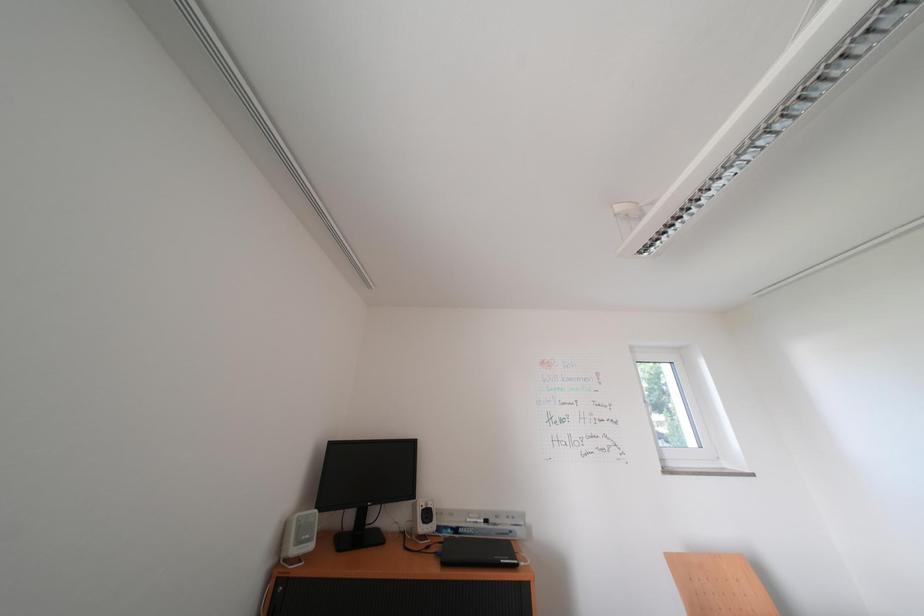
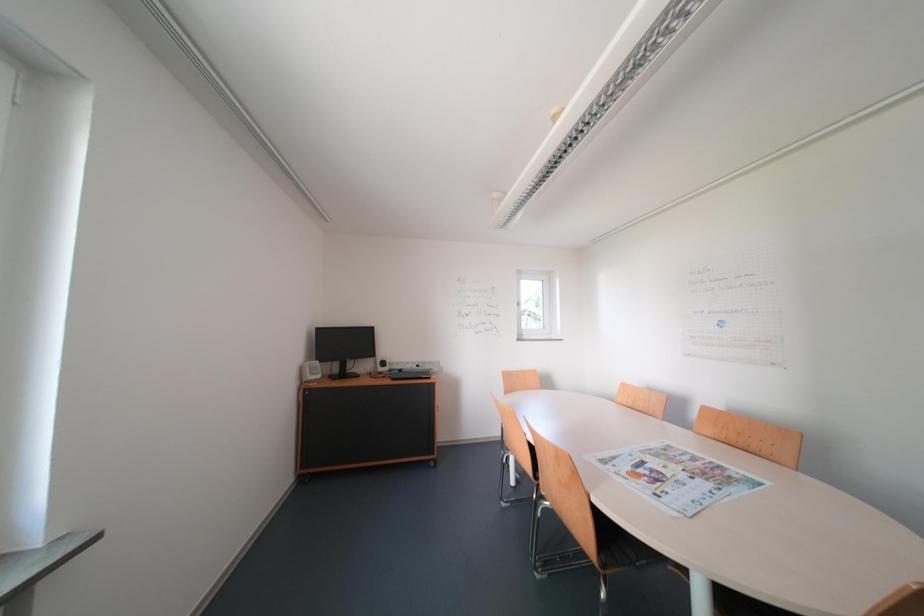
Question: The images are taken continuously from a first-person perspective. In which direction are you moving?

Choices:
 (A) Left
 (B) Right
 (C) Forward
 (D) Backward

Answer: (D)